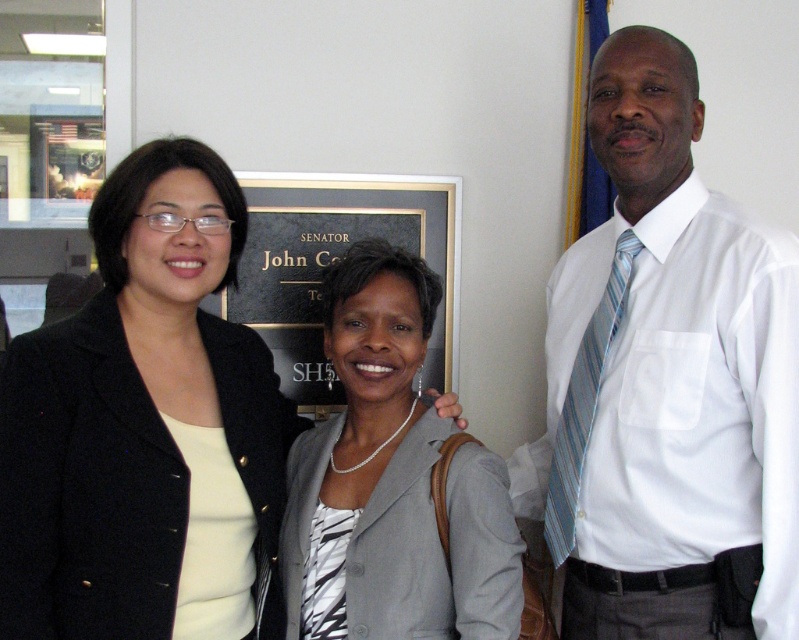
Is point (244, 476) closer to viewer compared to point (431, 442)?

No.

Is matte black blazer at center to the right of gray fabric jacket at center from the viewer's perspective?

Incorrect, matte black blazer at center is not on the right side of gray fabric jacket at center.

Is point (231, 500) less distant than point (336, 618)?

No, (231, 500) is behind (336, 618).

At what (x,y) coordinates should I click in order to perform the action: click on matte black blazer at center. Please return your answer as a coordinate pair (x, y). The image size is (799, 640). Looking at the image, I should click on (145, 428).

Between white shirt and tie at right and matte black blazer at center, which one appears on the right side from the viewer's perspective?

From the viewer's perspective, white shirt and tie at right appears more on the right side.

Can you confirm if white shirt and tie at right is thinner than matte black blazer at center?

Yes, white shirt and tie at right is thinner than matte black blazer at center.

Is point (646, 353) farther from viewer compared to point (38, 438)?

Yes, it is.

Locate an element on the screen. Image resolution: width=799 pixels, height=640 pixels. white shirt and tie at right is located at coordinates (668, 376).

Is matte black blazer at center further to camera compared to blue striped tie at right?

No, matte black blazer at center is closer to the viewer.

This screenshot has height=640, width=799. What do you see at coordinates (145, 428) in the screenshot? I see `matte black blazer at center` at bounding box center [145, 428].

Identify the location of matte black blazer at center. This screenshot has width=799, height=640. tap(145, 428).